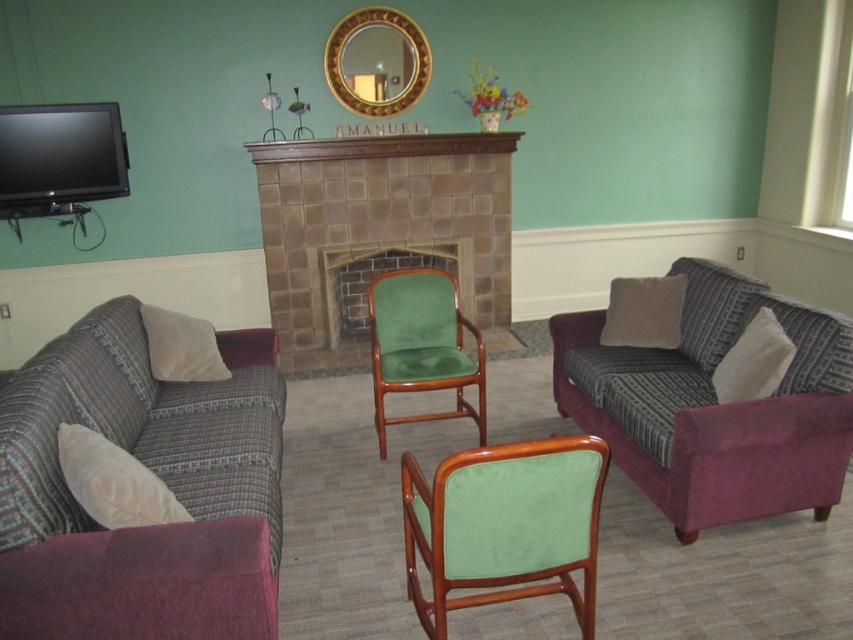
You are standing in the living room and want to place a 1.5 meter long sofa in front of the brown tile fireplace at center. Is there enough space between you and the fireplace to accommodate the sofa?

The distance between you and the brown tile fireplace at center is 4.78 meters, which is more than enough to place a 1.5 meter long sofa in front of it.

From the picture: You are sitting on the plaid fabric couch at lower left and want to reach the remote control placed on the green velvet chair at center. Can you easily reach it without moving from your seat?

The plaid fabric couch at lower left is taller than the green velvet chair at center, so you might have difficulty reaching the remote control placed on the green velvet chair at center from your current position due to the height difference.